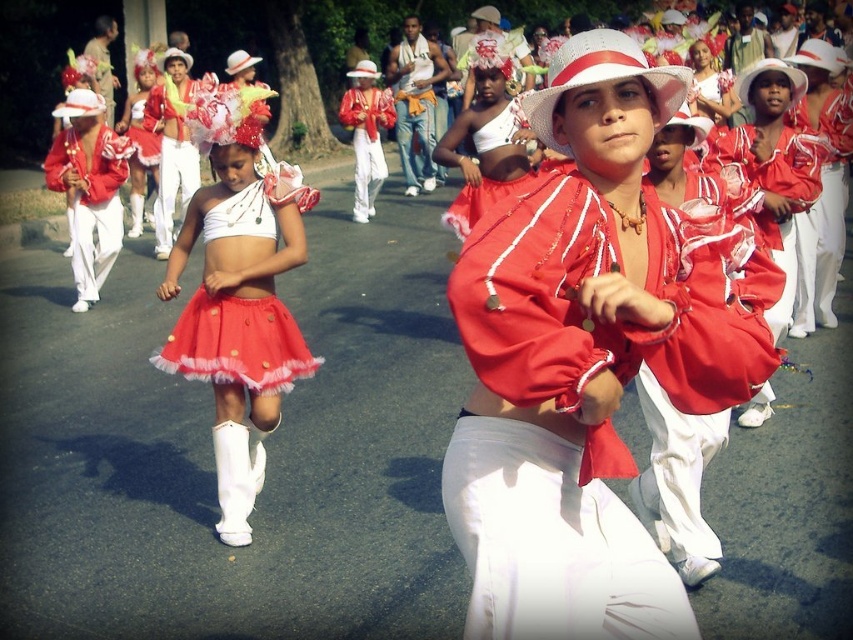
You are a costume designer observing the performers in the scene. You need to determine which part of the costume at the center has a greater horizontal span. Which one is wider between the matte red blouse at center and the matte red skirt at center?

The matte red blouse at center has a greater width than the matte red skirt at center, so the blouse is wider.

You are a photographer trying to capture the perfect shot of the performers. You notice the matte red blouse at center and the matte red skirt at center. Which clothing item should you focus on first if you want to capture the top part of the performer?

The matte red blouse at center is located above the matte red skirt at center, so focusing on the matte red blouse at center first will capture the top part of the performer.

You are standing at the center of the scene and notice a point marked at coordinates (589,356). Which object is located at that point?

The point at (589,356) indicates the location of the matte red blouse at center.